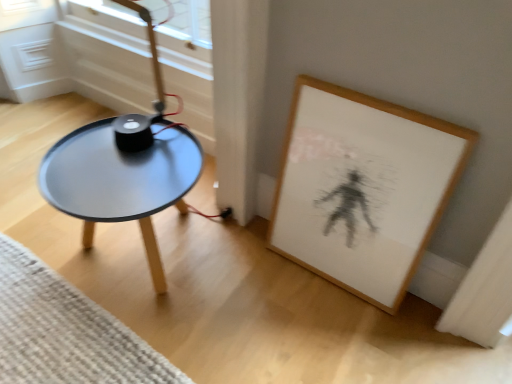
Question: Looking at their shapes, would you say matte black table at left is wider or thinner than wooden framed artwork at lower right?

Choices:
 (A) wide
 (B) thin

Answer: (A)

Question: From the image's perspective, relative to wooden framed artwork at lower right, is matte black table at left above or below?

Choices:
 (A) below
 (B) above

Answer: (A)

Question: Which is farther from the woven beige mat at lower left?

Choices:
 (A) wooden framed artwork at lower right
 (B) matte black table at left

Answer: (A)

Question: Estimate the real-world distances between objects in this image. Which object is farther from the wooden framed artwork at lower right?

Choices:
 (A) woven beige mat at lower left
 (B) matte black table at left

Answer: (A)